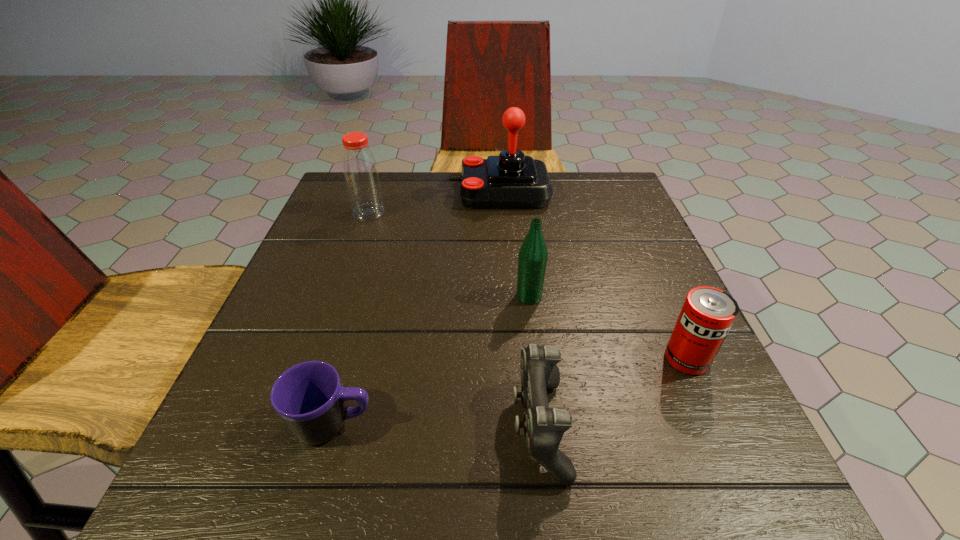
Find the location of a particular element. joystick is located at coordinates (511, 180).

I want to click on the farther bottle, so click(x=362, y=180).

I want to click on the third farthest object, so click(x=533, y=255).

Locate an element on the screen. the right bottle is located at coordinates (533, 255).

This screenshot has height=540, width=960. What are the coordinates of `can` in the screenshot? It's located at (707, 315).

At what (x,y) coordinates should I click in order to perform the action: click on the third shortest object. Please return your answer as a coordinate pair (x, y). This screenshot has width=960, height=540. Looking at the image, I should click on (707, 315).

Locate an element on the screen. This screenshot has width=960, height=540. the second shortest object is located at coordinates (544, 427).

Where is `the shortest object`? The height and width of the screenshot is (540, 960). the shortest object is located at coordinates (309, 398).

Where is `vacant area located on the base of the joystick`? This screenshot has height=540, width=960. vacant area located on the base of the joystick is located at coordinates (385, 192).

Identify the location of vacant area situated on the base of the joystick. The height and width of the screenshot is (540, 960). (373, 192).